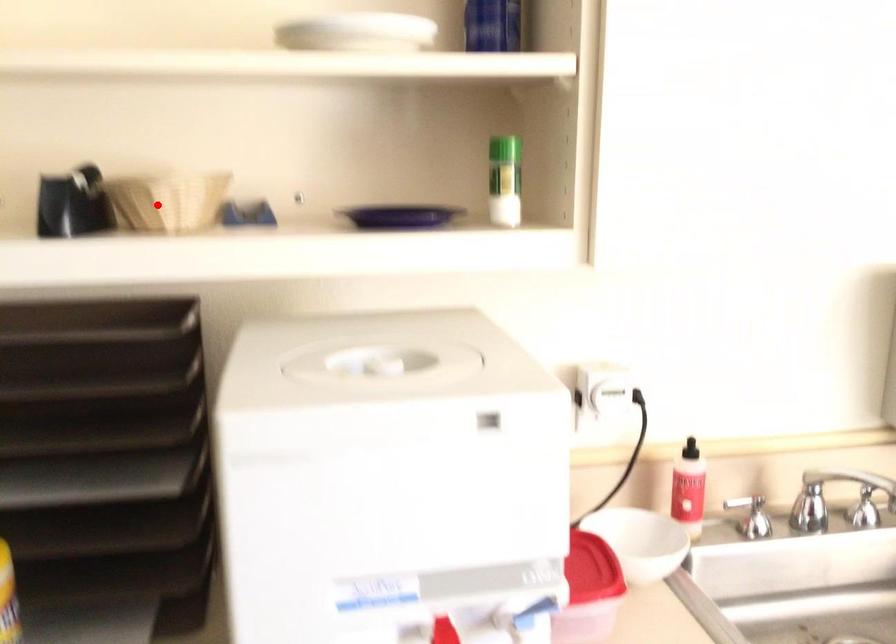
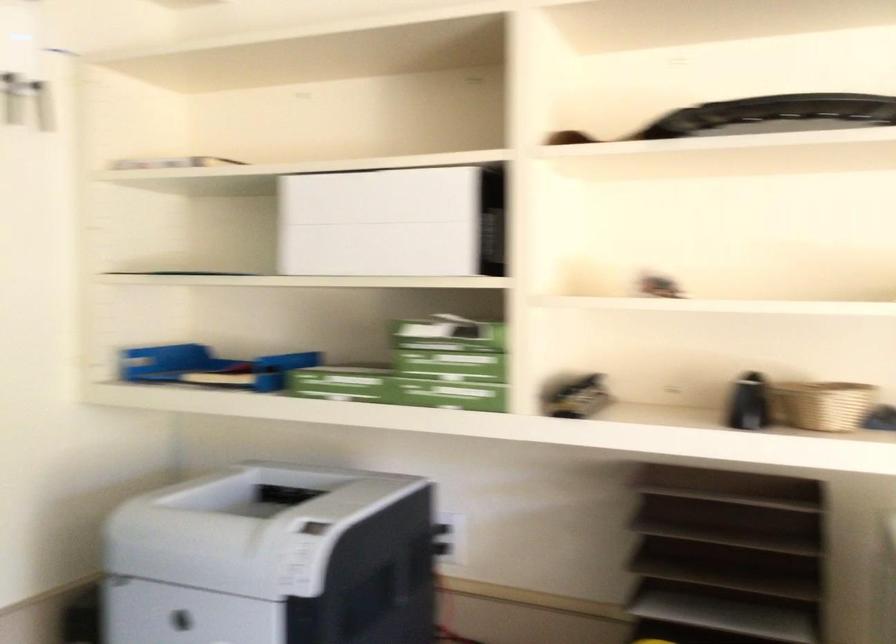
Question: A red point is marked in image1. In image2, is the corresponding 3D point closer to the camera or farther? Reply with the corresponding letter.

Choices:
 (A) The corresponding 3D point is closer.
 (B) The corresponding 3D point is farther.

Answer: (B)